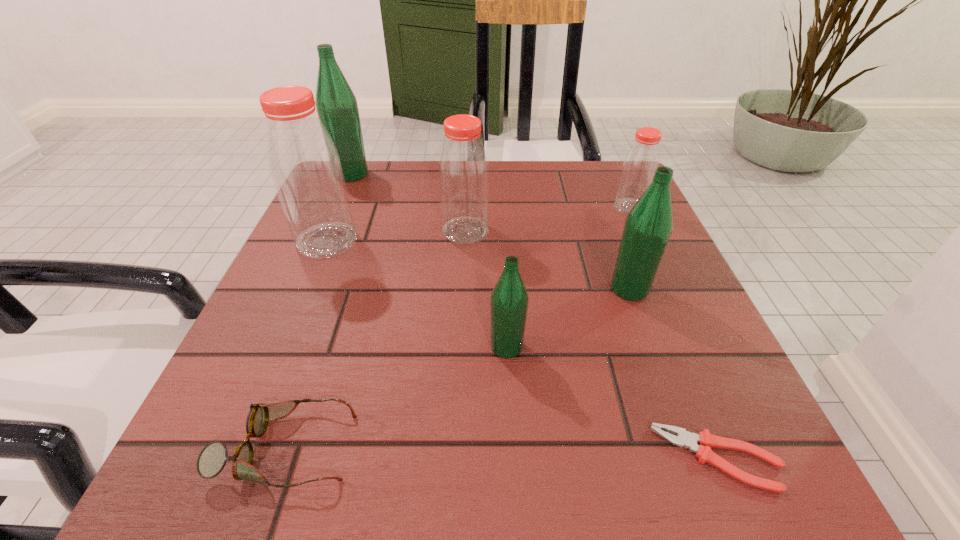
Where is `red bottle that is the closest to the second red bottle from right to left`? Image resolution: width=960 pixels, height=540 pixels. red bottle that is the closest to the second red bottle from right to left is located at coordinates (305, 167).

Locate an element on the screen. free space in the image that satisfies the following two spatial constraints: 1. on the back side of the smallest red bottle; 2. on the right side of the shortest object is located at coordinates (615, 207).